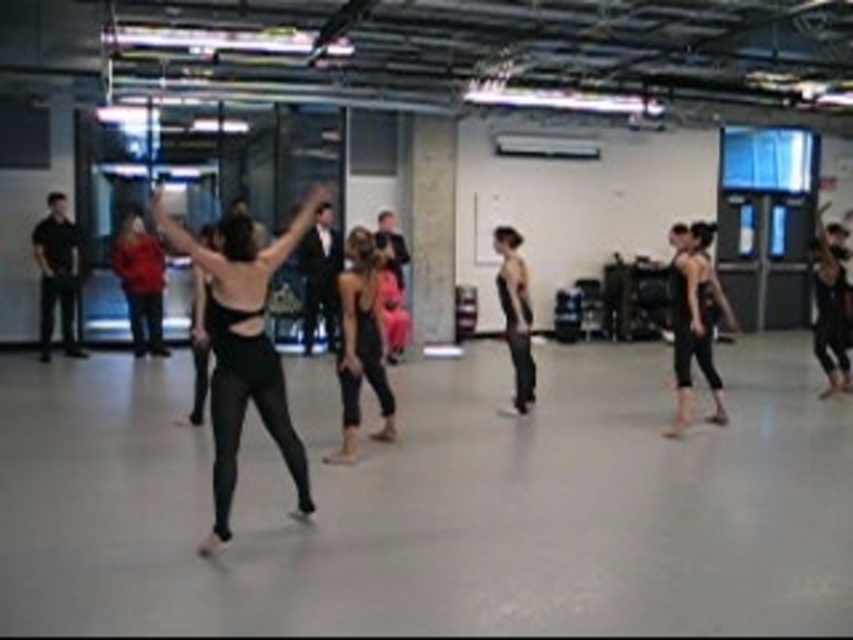
Is black matte leggings at center taller than matte black tank top at center?

Correct, black matte leggings at center is much taller as matte black tank top at center.

Is black matte leggings at center thinner than matte black tank top at center?

No, black matte leggings at center is not thinner than matte black tank top at center.

Is point (276, 246) positioned after point (370, 348)?

No, (276, 246) is in front of (370, 348).

I want to click on black matte leggings at center, so click(x=244, y=348).